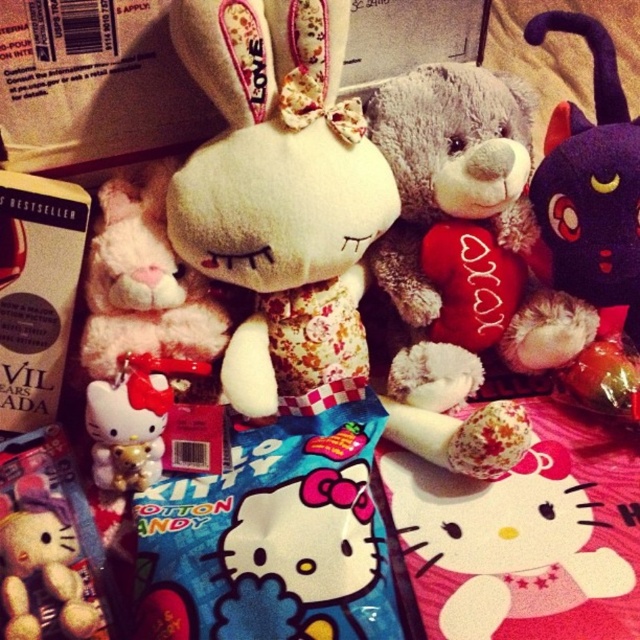
You are organizing a display of plush toys and need to place a new item between the white plush at center and the gray teddy bear holding a red heart pillow with oxox. According to the scene, where should you position the new item to ensure it is between them?

The white plush at center is located at point (145,284). To place the new item between it and the gray teddy bear holding a red heart pillow with oxox, you should position it along the line connecting their coordinates, ensuring it is halfway between the two points.

You are looking at the scene with the plush bunny, teddy bear, and purple cat. There are two points marked in the image. Which point is closer to you, point (488, 118) or point (88, 605)?

Point (488, 118) is closer to you because it is further to the viewer than point (88, 605).

You are a child trying to reach the two points in the image. Which point, point (403, 228) or point (353, 614), is closer to you?

Point (403, 228) is closer to you because it is further to the viewer than point (353, 614).